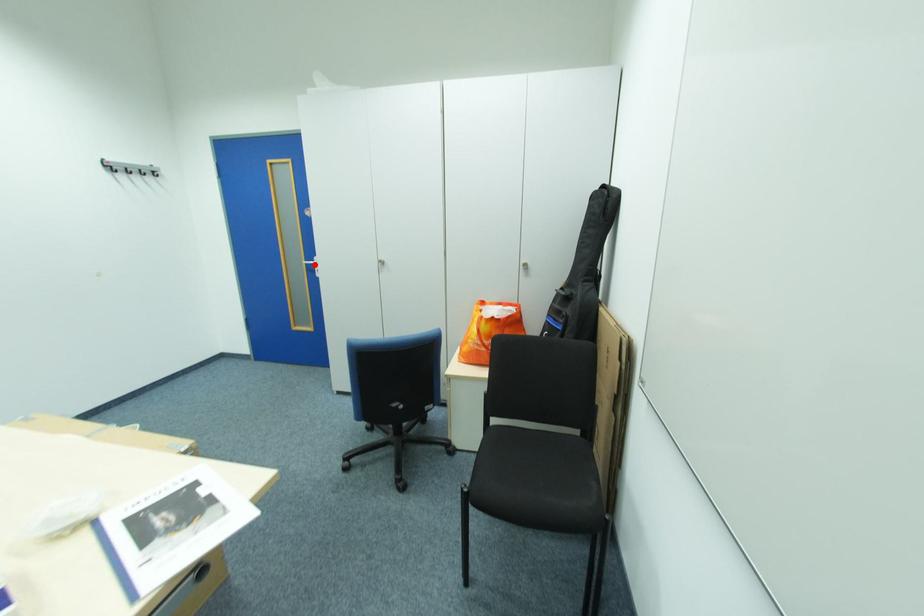
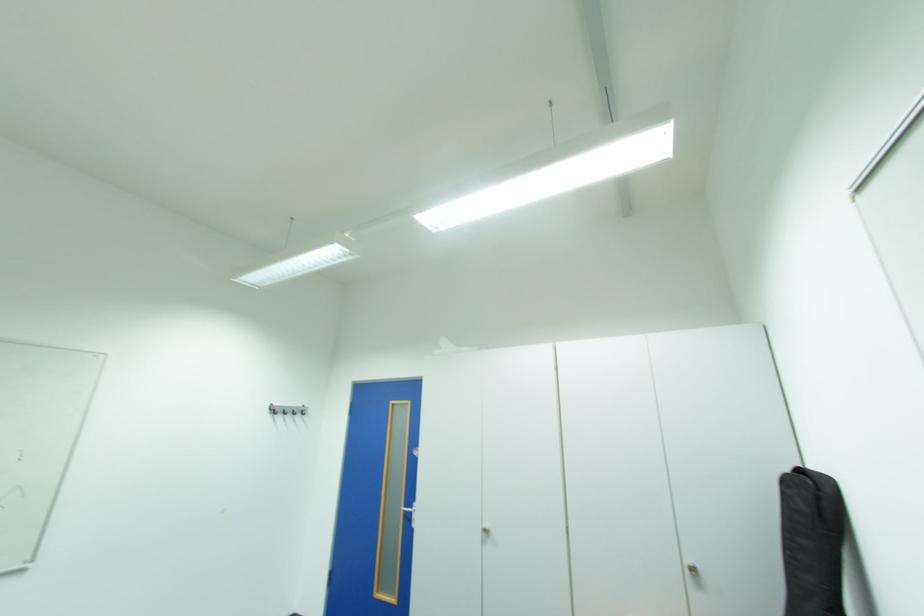
Question: I am providing you with two images of the same scene from different viewpoints. Given a red point in image1, look at the same physical point in image2. Is it:

Choices:
 (A) Closer to the viewpoint
 (B) Farther from the viewpoint

Answer: (B)